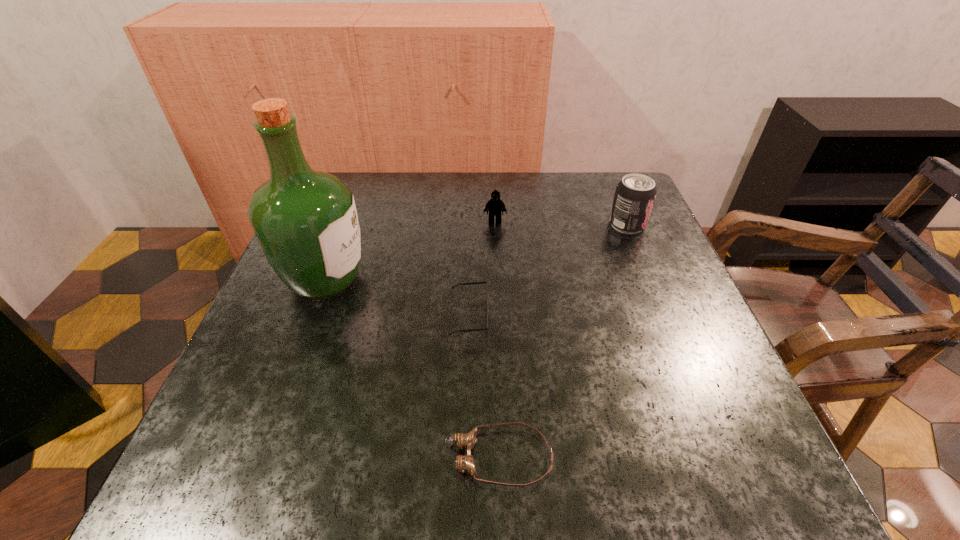
This screenshot has width=960, height=540. I want to click on vacant space located 0.250m on the face of the Lego, so click(498, 297).

Find the location of a particular element. vacant area situated on the front-facing side of the fourth tallest object is located at coordinates (672, 316).

Image resolution: width=960 pixels, height=540 pixels. I want to click on free space located 0.320m on the front lenses and sides of the goggles, so click(x=229, y=457).

This screenshot has height=540, width=960. I want to click on free space located 0.060m on the front lenses and sides of the goggles, so click(404, 457).

You are a GUI agent. You are given a task and a screenshot of the screen. Output one action in this format:
    pyautogui.click(x=<x>, y=<y>)
    Task: Click on the vacant point located 0.240m on the front lenses and sides of the goggles
    
    Given the screenshot: What is the action you would take?
    pyautogui.click(x=283, y=457)

Identify the location of soda can located at the far edge. The height and width of the screenshot is (540, 960). (634, 197).

Locate an element on the screen. The image size is (960, 540). Lego situated at the far edge is located at coordinates (494, 205).

Locate an element on the screen. The width and height of the screenshot is (960, 540). object at the near edge is located at coordinates (464, 463).

Find the location of a particular element. This screenshot has height=540, width=960. object situated at the left edge is located at coordinates (305, 220).

Where is `object that is at the right edge`? object that is at the right edge is located at coordinates (634, 197).